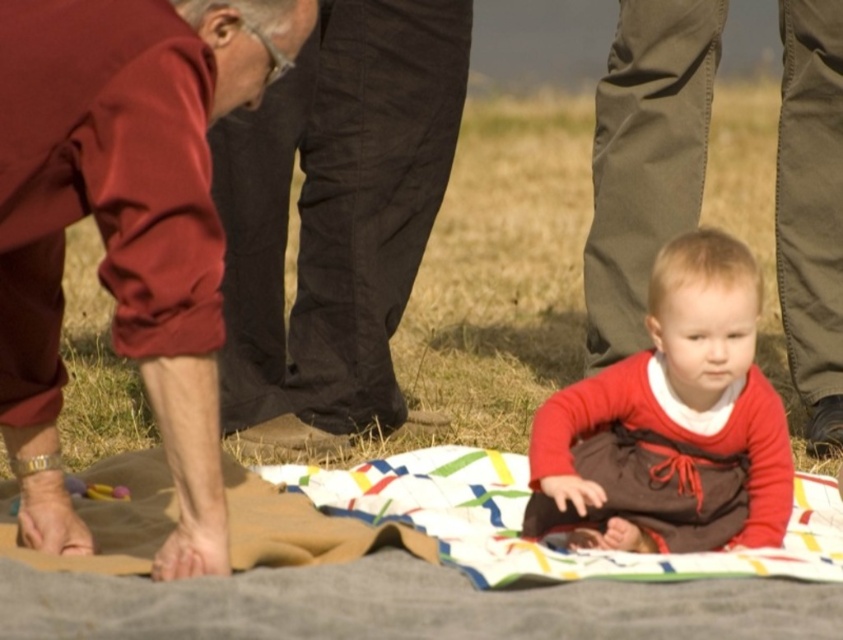
You are a photographer setting up a tripod in this scene. You need to position the tripod so that it doesn not block the view of both the dark brown pants at left and the matte red dress at center. Given their heights, which object might require you to lower the tripod height to ensure both are fully visible?

The dark brown pants at left is taller than the matte red dress at center. To ensure both are fully visible, you might need to lower the tripod height based on the taller dark brown pants at left.

You are a photographer trying to capture a closeup of the baby on the blanket. You notice two pairs of pants in the background. Which pair of pants, the dark brown pants at left or the maroon fabric pants at lower left, is larger in size?

The dark brown pants at left is bigger than maroon fabric pants at lower left, so the dark brown pants at left is the larger pair.

You are standing in the park scene and notice a baby on a blanket. There is also a point marked at coordinates (x=170, y=250). What object is located at this point?

The point at coordinates (x=170, y=250) corresponds to the maroon fabric pants at lower left.